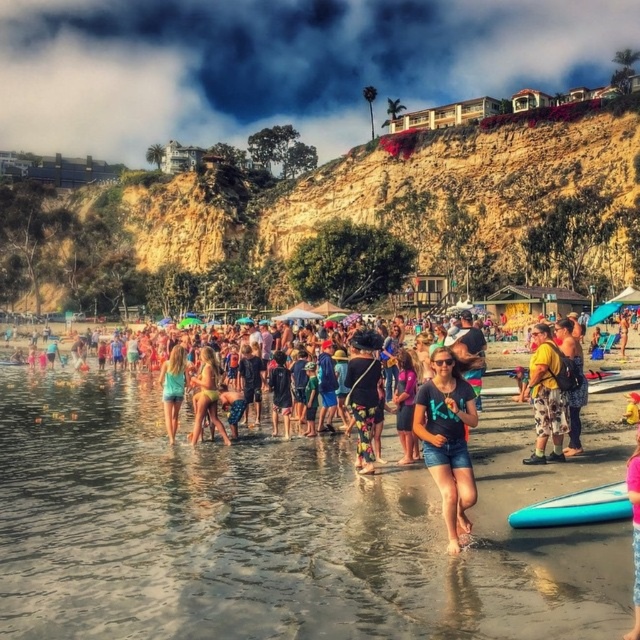
Does point (417, 426) come farther from viewer compared to point (173, 412)?

No, it is in front of (173, 412).

Where is `matte black t-shirt at center`? matte black t-shirt at center is located at coordinates click(448, 440).

Which is more to the left, cliffy sandstone cliff at upper center or matte blue shorts at center?

From the viewer's perspective, matte blue shorts at center appears more on the left side.

Is cliffy sandstone cliff at upper center shorter than matte blue shorts at center?

In fact, cliffy sandstone cliff at upper center may be taller than matte blue shorts at center.

Find the location of a particular element. The image size is (640, 640). cliffy sandstone cliff at upper center is located at coordinates (342, 220).

The width and height of the screenshot is (640, 640). I want to click on cliffy sandstone cliff at upper center, so click(x=342, y=220).

Which is below, floral-patterned shorts at center-right or pink fabric shorts at lower right?

pink fabric shorts at lower right is below.

Which of these two, floral-patterned shorts at center-right or pink fabric shorts at lower right, stands taller?

Standing taller between the two is floral-patterned shorts at center-right.

Is point (579, 346) farther from viewer compared to point (627, 477)?

Yes, it is.

Where is `floral-patterned shorts at center-right`? This screenshot has width=640, height=640. floral-patterned shorts at center-right is located at coordinates (579, 380).